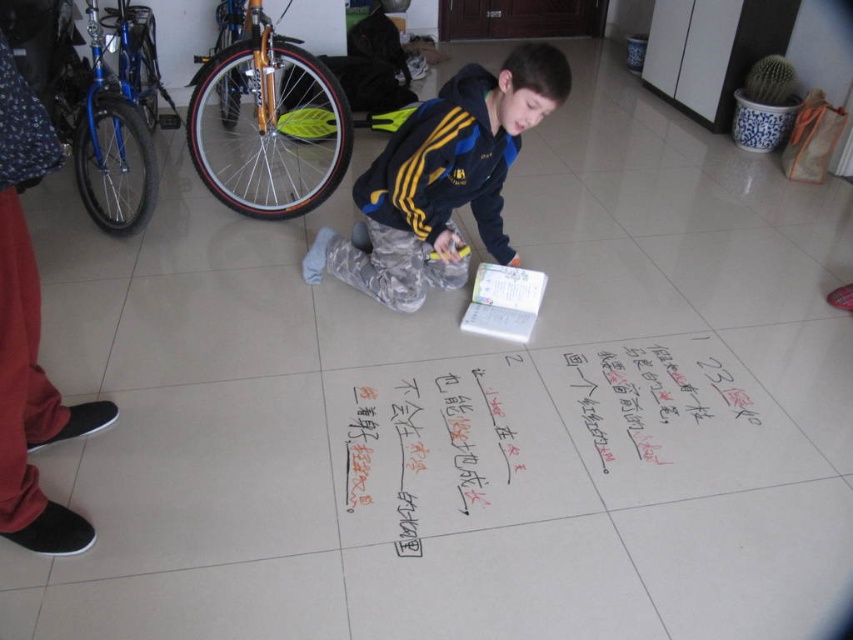
Is point (392, 474) farther from camera compared to point (119, 147)?

No, it is not.

Looking at this image, is handwritten paper at center wider than blue metallic bicycle at upper left?

Yes.

Does point (425, 429) lie in front of point (93, 65)?

Yes, point (425, 429) is closer to viewer.

Where is `handwritten paper at center`? handwritten paper at center is located at coordinates (540, 436).

Consider the image. Who is lower down, gold metallic bicycle wheel at left or blue metallic bicycle at upper left?

Positioned lower is blue metallic bicycle at upper left.

Does point (238, 90) come in front of point (144, 160)?

No, (238, 90) is behind (144, 160).

You are a GUI agent. You are given a task and a screenshot of the screen. Output one action in this format:
    pyautogui.click(x=<x>, y=<y>)
    Task: Click on the gold metallic bicycle wheel at left
    The height and width of the screenshot is (640, 853).
    Given the screenshot: What is the action you would take?
    pyautogui.click(x=267, y=124)

Does point (650, 404) come farther from viewer compared to point (305, 179)?

No.

Describe the element at coordinates (540, 436) in the screenshot. I see `handwritten paper at center` at that location.

The height and width of the screenshot is (640, 853). I want to click on handwritten paper at center, so 540,436.